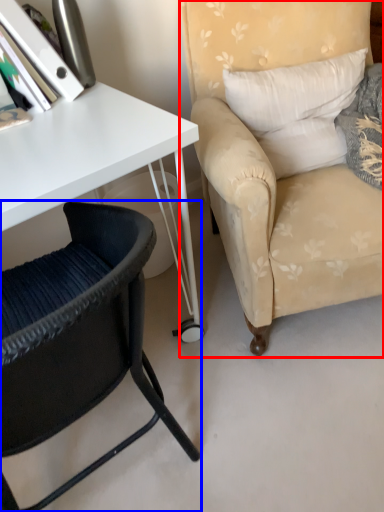
Question: Among these objects, which one is farthest to the camera, chair (highlighted by a red box) or chair (highlighted by a blue box)?

Choices:
 (A) chair
 (B) chair

Answer: (A)